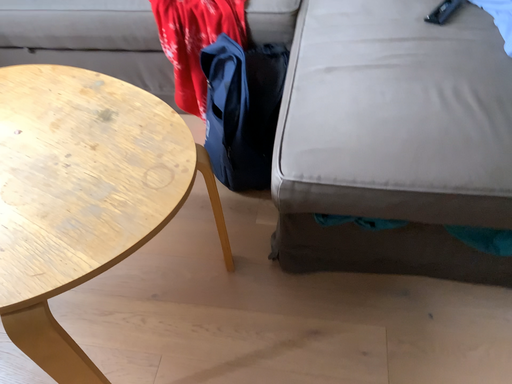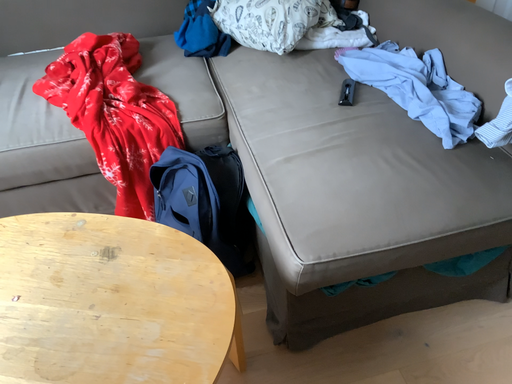
Question: Which way did the camera rotate in the video?

Choices:
 (A) rotated upward
 (B) rotated downward

Answer: (A)